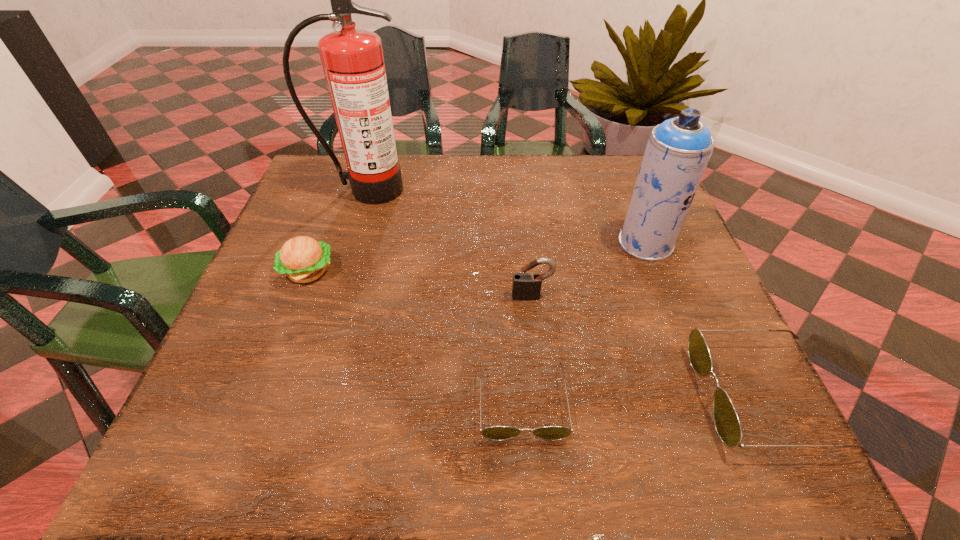
Where is `the shorter sunglasses`? the shorter sunglasses is located at coordinates (497, 433).

Where is `the shortest object`? the shortest object is located at coordinates (497, 433).

At what (x,y) coordinates should I click in order to perform the action: click on the second shortest object. Please return your answer as a coordinate pair (x, y). The height and width of the screenshot is (540, 960). Looking at the image, I should click on (726, 421).

You are a GUI agent. You are given a task and a screenshot of the screen. Output one action in this format:
    pyautogui.click(x=<x>, y=<y>)
    Task: Click on the right sunglasses
    The height and width of the screenshot is (540, 960).
    Given the screenshot: What is the action you would take?
    pyautogui.click(x=726, y=421)

This screenshot has width=960, height=540. I want to click on the tallest object, so click(352, 59).

At what (x,y) coordinates should I click in order to perform the action: click on the farthest object. Please return your answer as a coordinate pair (x, y). This screenshot has height=540, width=960. Looking at the image, I should click on (352, 59).

You are a GUI agent. You are given a task and a screenshot of the screen. Output one action in this format:
    pyautogui.click(x=<x>, y=<y>)
    Task: Click on the fourth shortest object
    The height and width of the screenshot is (540, 960).
    Given the screenshot: What is the action you would take?
    pyautogui.click(x=526, y=286)

This screenshot has height=540, width=960. In order to click on padlock in this screenshot , I will do `click(526, 286)`.

Find the location of a particular element. hamburger is located at coordinates (303, 259).

At what (x,y) coordinates should I click in order to perform the action: click on aerosol can. Please return your answer as a coordinate pair (x, y). The width and height of the screenshot is (960, 540). Looking at the image, I should click on (678, 150).